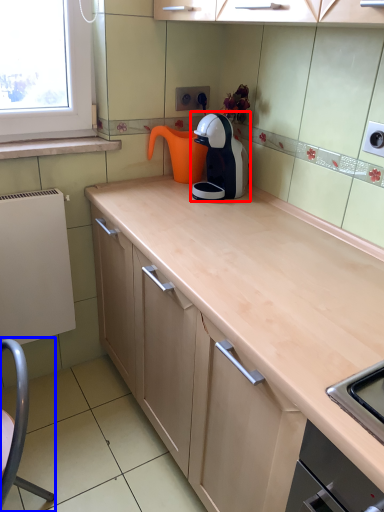
Question: Which point is closer to the camera, kitchen appliance (highlighted by a red box) or swivel chair (highlighted by a blue box)?

Choices:
 (A) kitchen appliance
 (B) swivel chair

Answer: (B)